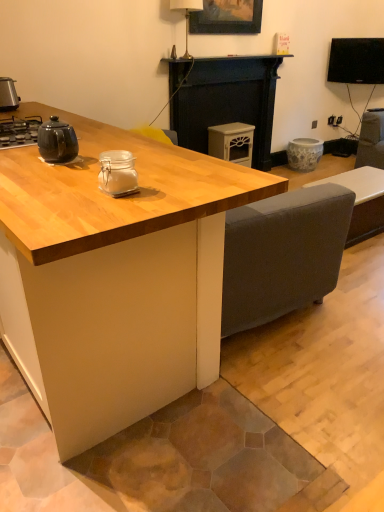
I want to click on free location to the left of matte black teapot at left, so click(x=20, y=159).